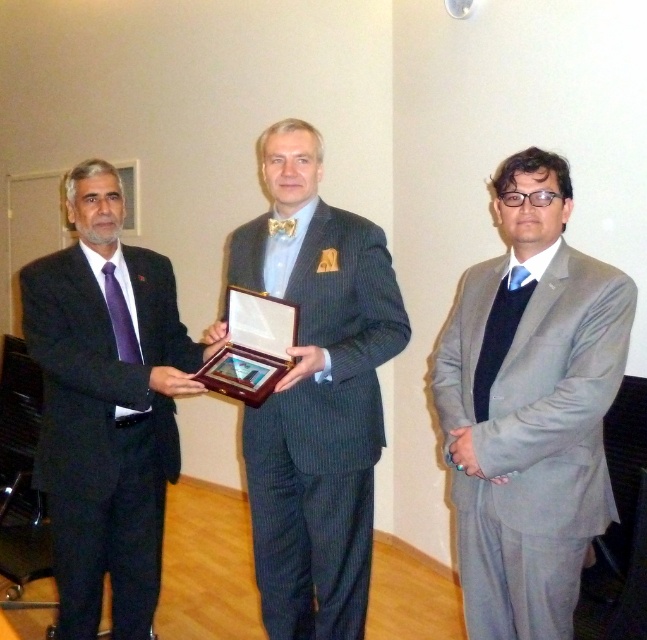
You are a photographer setting up for a group photo. The pinstriped suit at center and the matte black suit at left are part of the group. If you want to ensure both are in focus, what is the minimum distance you should set your camera lens to focus on?

The pinstriped suit at center is 15.76 inches away from the matte black suit at left. To ensure both are in focus, the camera lens should be focused on a point between them, typically the midpoint, which would be around 7.88 inches from each. However, the minimum focusing distance required would depend on the lens aperture and depth of field. A smaller aperture like f16 would provide a greater depth of field, allowing both subjects to be in focus at a distance that accommodates their separation.